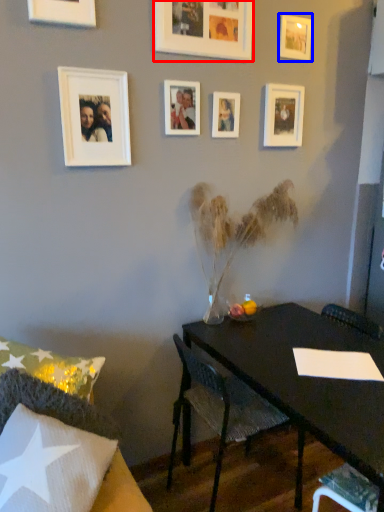
Question: Which of the following is the closest to the observer, picture frame (highlighted by a red box) or picture frame (highlighted by a blue box)?

Choices:
 (A) picture frame
 (B) picture frame

Answer: (A)